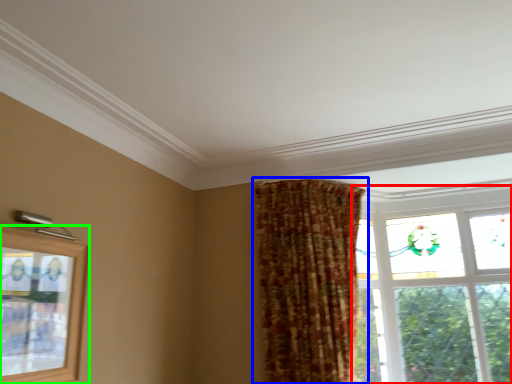
Question: Which object is the farthest from window (highlighted by a red box)? Choose among these: curtain (highlighted by a blue box) or window (highlighted by a green box).

Choices:
 (A) curtain
 (B) window

Answer: (B)